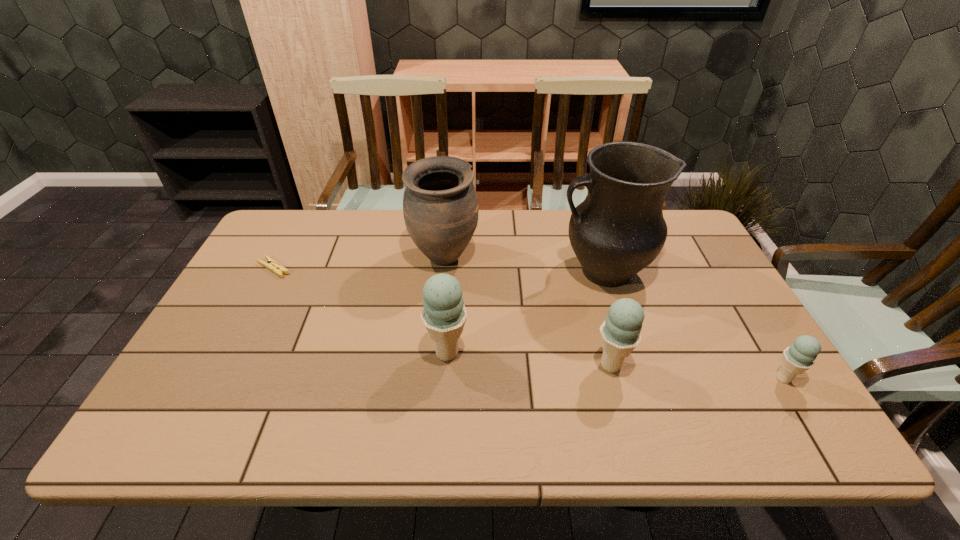
You are a GUI agent. You are given a task and a screenshot of the screen. Output one action in this format:
    pyautogui.click(x=<x>, y=<y>)
    Task: Click on the unoccupied area between the urn and the third shortest object
    
    Given the screenshot: What is the action you would take?
    pyautogui.click(x=528, y=312)

I want to click on unoccupied position between the urn and the fourth tallest object, so (x=528, y=312).

At what (x,y) coordinates should I click in order to perform the action: click on empty location between the clothespin and the tallest object. Please return your answer as a coordinate pair (x, y). This screenshot has height=540, width=960. Looking at the image, I should click on (439, 269).

Where is `the fifth closest object to the leftmost ice cream`? the fifth closest object to the leftmost ice cream is located at coordinates (x=799, y=357).

Locate an element on the screen. The image size is (960, 540). object that is the second closest to the fifth shortest object is located at coordinates (618, 230).

Where is `ice cream object that ranks as the second closest to the leftmost ice cream`? ice cream object that ranks as the second closest to the leftmost ice cream is located at coordinates (799, 357).

Identify the location of ice cream that can be found as the closest to the second tallest ice cream. (444, 314).

This screenshot has width=960, height=540. Identify the location of vacant space that satisfies the following two spatial constraints: 1. on the handle side of the second shortest object; 2. on the left side of the pitcher. (636, 379).

This screenshot has width=960, height=540. What are the coordinates of `free location that satisfies the following two spatial constraints: 1. on the front side of the leftmost ice cream; 2. on the left side of the rightmost ice cream` in the screenshot? It's located at (445, 379).

The width and height of the screenshot is (960, 540). I want to click on vacant region that satisfies the following two spatial constraints: 1. on the handle side of the tallest object; 2. on the left side of the rightmost object, so click(636, 379).